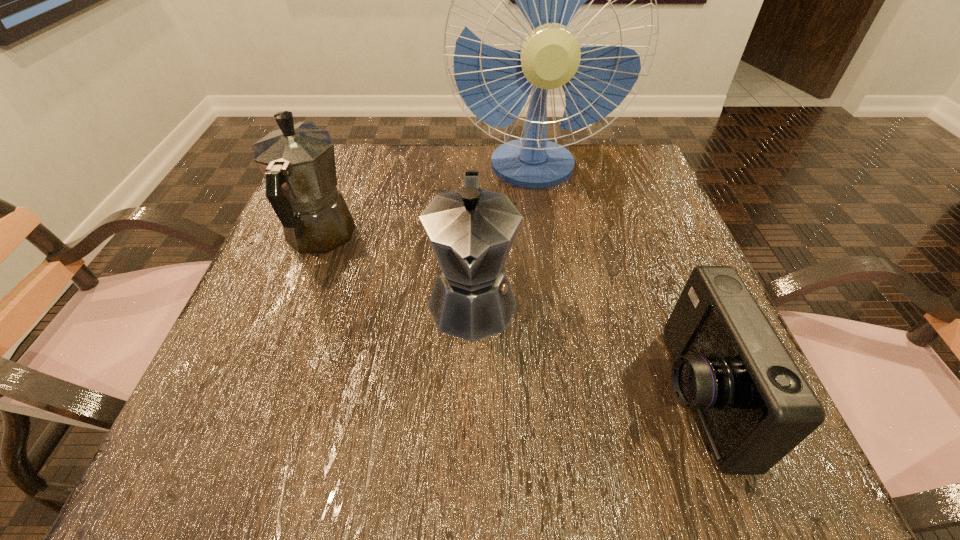
This screenshot has width=960, height=540. In order to click on the farthest object in this screenshot , I will do `click(495, 84)`.

You are a GUI agent. You are given a task and a screenshot of the screen. Output one action in this format:
    pyautogui.click(x=<x>, y=<y>)
    Task: Click on the fan
    
    Given the screenshot: What is the action you would take?
    pyautogui.click(x=495, y=84)

Find the location of a particular element. Image resolution: width=960 pixels, height=540 pixels. the left coffeepot is located at coordinates (298, 163).

The height and width of the screenshot is (540, 960). I want to click on the right coffeepot, so click(471, 231).

I want to click on the shortest object, so click(754, 405).

Locate an element on the screen. The width and height of the screenshot is (960, 540). free space located at the front of the farthest object where the blades are visible is located at coordinates (541, 222).

You are a GUI agent. You are given a task and a screenshot of the screen. Output one action in this format:
    pyautogui.click(x=<x>, y=<y>)
    Task: Click on the vacant region located on the pouring side of the leftmost object
    This screenshot has height=540, width=960.
    Given the screenshot: What is the action you would take?
    pyautogui.click(x=345, y=173)

Where is `free space located on the pouring side of the leftmost object`? The image size is (960, 540). free space located on the pouring side of the leftmost object is located at coordinates (339, 187).

The height and width of the screenshot is (540, 960). Identify the location of vacant region located on the pouring side of the leftmost object. (338, 190).

The width and height of the screenshot is (960, 540). I want to click on free region located 0.060m at the spout of the right coffeepot, so click(471, 386).